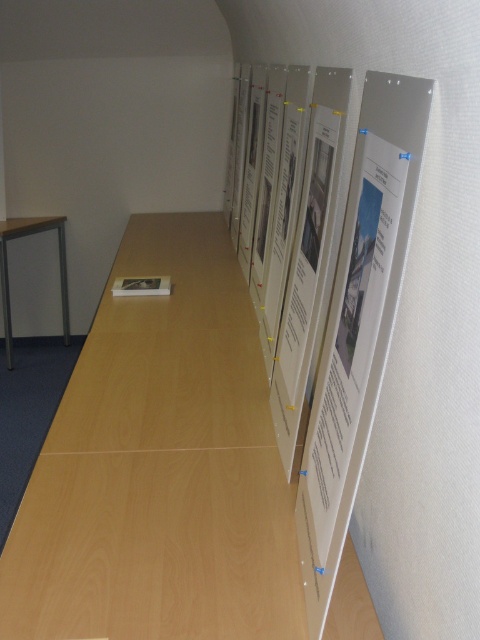
You are standing in a hallway and see a point marked at coordinates (394, 216). If you want to touch this point with a 60 cm long stick, will the stick reach it?

The distance between the point and the viewer is 71.24 centimeters. Since the stick is only 60 cm long, it cannot reach the point.

You are standing in the hallway and want to place a small sticker exactly at the center of the white paper at upper right. According to the coordinates provided, where should you place the sticker?

The sticker should be placed at the center of the white paper at upper right, which is located at coordinates approximately 0.506 on the x and 0.748 on the y axis.

You are standing in the hallway and need to place a small object on the nearest surface. Which object should you choose between the white paper at upper right and the matte black table at left?

You should choose the matte black table at left because it is a surface, while the white paper at upper right is positioned to the right of it but is likely not a stable surface for placing objects.